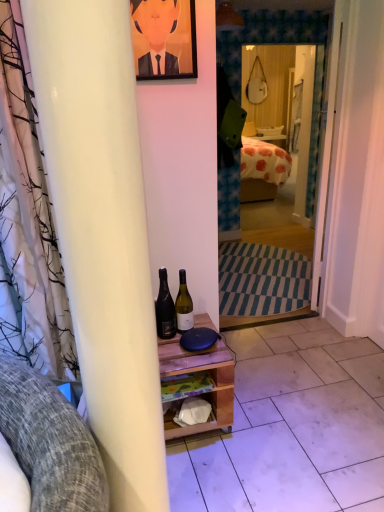
Question: Considering the relative sizes of matte white mirror at center and white wooden door at center in the image provided, is matte white mirror at center bigger than white wooden door at center?

Choices:
 (A) yes
 (B) no

Answer: (A)

Question: Does matte white mirror at center contain white wooden door at center?

Choices:
 (A) yes
 (B) no

Answer: (B)

Question: Is matte white mirror at center turned away from white wooden door at center?

Choices:
 (A) no
 (B) yes

Answer: (A)

Question: Is matte white mirror at center far from white wooden door at center?

Choices:
 (A) yes
 (B) no

Answer: (A)

Question: Could you tell me if matte white mirror at center is facing white wooden door at center?

Choices:
 (A) no
 (B) yes

Answer: (B)

Question: Relative to white wooden door at center, is wooden shelf at center, arranged as the second tile when viewed from the right, in front or behind?

Choices:
 (A) behind
 (B) front

Answer: (B)

Question: Considering the positions of wooden shelf at center, arranged as the second tile when viewed from the right, and white wooden door at center in the image, is wooden shelf at center, arranged as the second tile when viewed from the right, bigger or smaller than white wooden door at center?

Choices:
 (A) small
 (B) big

Answer: (A)

Question: From a real-world perspective, is wooden shelf at center, which is the first tile from left to right, above or below white wooden door at center?

Choices:
 (A) above
 (B) below

Answer: (B)

Question: From the image's perspective, is wooden shelf at center, which is the first tile from left to right, located above or below white wooden door at center?

Choices:
 (A) above
 (B) below

Answer: (B)

Question: Based on their positions, is orange painted portrait at upper center located to the left or right of black glass bottle at center, the 1th bottle from the left?

Choices:
 (A) right
 (B) left

Answer: (B)

Question: Is orange painted portrait at upper center situated inside black glass bottle at center, the 1th bottle from the left, or outside?

Choices:
 (A) inside
 (B) outside

Answer: (B)

Question: From the image's perspective, is orange painted portrait at upper center positioned above or below black glass bottle at center, the 1th bottle from the left?

Choices:
 (A) above
 (B) below

Answer: (A)

Question: Does point (150, 29) appear closer or farther from the camera than point (167, 287)?

Choices:
 (A) farther
 (B) closer

Answer: (B)

Question: Is point (160, 285) closer or farther from the camera than point (279, 86)?

Choices:
 (A) farther
 (B) closer

Answer: (B)

Question: From a real-world perspective, is black glass bottle at center, which ranks as the second bottle in right-to-left order, positioned above or below matte white mirror at center?

Choices:
 (A) below
 (B) above

Answer: (A)